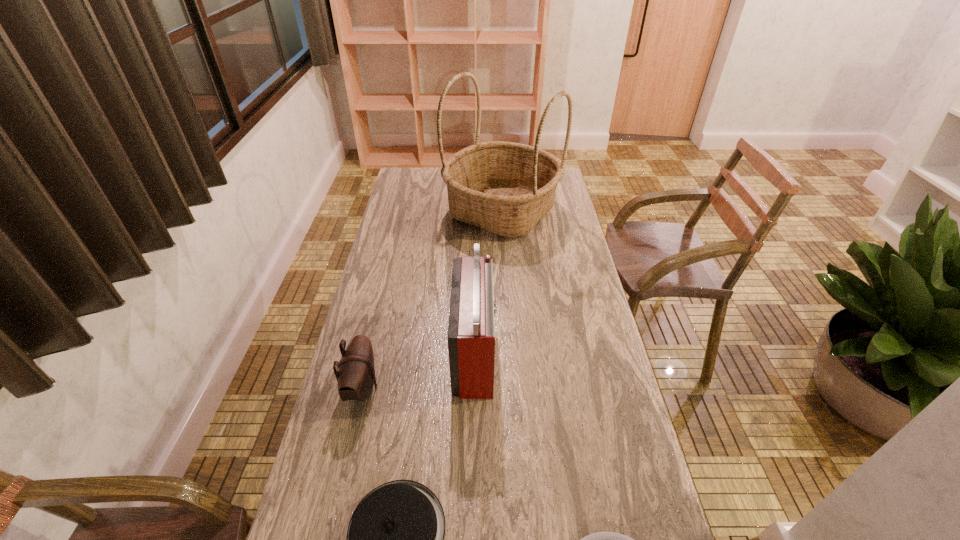
Where is `basket`? This screenshot has height=540, width=960. basket is located at coordinates (504, 187).

Find the location of a particular element. The image size is (960, 540). the farthest object is located at coordinates (504, 187).

Where is `radio receiver`? This screenshot has width=960, height=540. radio receiver is located at coordinates pos(471,336).

The image size is (960, 540). Identify the location of the third tallest object. (356, 376).

Locate an element on the screen. The height and width of the screenshot is (540, 960). free point located on the front of the farthest object is located at coordinates (508, 306).

Identify the location of blank space located 0.240m on the front-facing side of the second tallest object. (574, 351).

Identify the location of free location located 0.200m with the flap open on the third tallest object. Image resolution: width=960 pixels, height=540 pixels. (449, 388).

Find the location of `object located in the far edge section of the desktop`. object located in the far edge section of the desktop is located at coordinates (504, 187).

Locate an element on the screen. object that is at the left edge is located at coordinates (356, 376).

At what (x,y) coordinates should I click in order to perform the action: click on object located at the right edge. Please return your answer as a coordinate pair (x, y). Looking at the image, I should click on (504, 187).